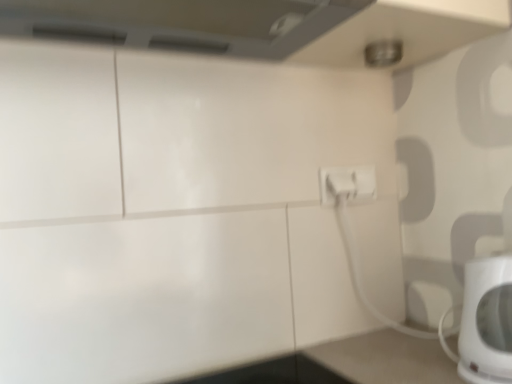
This screenshot has height=384, width=512. Describe the element at coordinates (347, 184) in the screenshot. I see `white plastic electric outlet at center-right` at that location.

What is the approximate width of white plastic electric outlet at center-right?

It is 1.53 inches.

Locate an element on the screen. white plastic electric outlet at center-right is located at coordinates (347, 184).

Measure the distance between point (475, 333) and camera.

The depth of point (475, 333) is 27.24 inches.

This screenshot has width=512, height=384. Find the location of `white glossy electric kettle at lower right`. white glossy electric kettle at lower right is located at coordinates tap(487, 321).

The image size is (512, 384). What do you see at coordinates (487, 321) in the screenshot?
I see `white glossy electric kettle at lower right` at bounding box center [487, 321].

The height and width of the screenshot is (384, 512). Find the location of `white plastic electric outlet at center-right`. white plastic electric outlet at center-right is located at coordinates (347, 184).

Considering the positions of objects white glossy electric kettle at lower right and white plastic electric outlet at center-right in the image provided, who is more to the right, white glossy electric kettle at lower right or white plastic electric outlet at center-right?

white glossy electric kettle at lower right is more to the right.

From the picture: Considering the positions of objects white glossy electric kettle at lower right and white plastic electric outlet at center-right in the image provided, who is behind, white glossy electric kettle at lower right or white plastic electric outlet at center-right?

white plastic electric outlet at center-right is more distant.

Which is closer, (465, 317) or (358, 170)?

Clearly, point (465, 317) is closer to the camera than point (358, 170).

From the image's perspective, which is above, white glossy electric kettle at lower right or white plastic electric outlet at center-right?

white plastic electric outlet at center-right, from the image's perspective.

Based on the photo, from a real-world perspective, is white glossy electric kettle at lower right physically below white plastic electric outlet at center-right?

Correct, in the physical world, white glossy electric kettle at lower right is lower than white plastic electric outlet at center-right.

In terms of width, does white glossy electric kettle at lower right look wider or thinner when compared to white plastic electric outlet at center-right?

In the image, white glossy electric kettle at lower right appears to be wider than white plastic electric outlet at center-right.

Does white glossy electric kettle at lower right have a lesser height compared to white plastic electric outlet at center-right?

In fact, white glossy electric kettle at lower right may be taller than white plastic electric outlet at center-right.

Considering the sizes of objects white glossy electric kettle at lower right and white plastic electric outlet at center-right in the image provided, who is smaller, white glossy electric kettle at lower right or white plastic electric outlet at center-right?

Smaller between the two is white plastic electric outlet at center-right.

Could white plastic electric outlet at center-right be considered to be inside white glossy electric kettle at lower right?

No.

Based on the photo, are white glossy electric kettle at lower right and white plastic electric outlet at center-right located far from each other?

They are positioned close to each other.

Is white glossy electric kettle at lower right oriented towards white plastic electric outlet at center-right?

No, white glossy electric kettle at lower right does not turn towards white plastic electric outlet at center-right.

Identify the location of electric outlet on the left of white glossy electric kettle at lower right. (347, 184).

Considering the relative positions of white plastic electric outlet at center-right and white glossy electric kettle at lower right in the image provided, is white plastic electric outlet at center-right to the left or to the right of white glossy electric kettle at lower right?

In the image, white plastic electric outlet at center-right appears on the left side of white glossy electric kettle at lower right.

Considering their positions, is white plastic electric outlet at center-right located in front of or behind white glossy electric kettle at lower right?

white plastic electric outlet at center-right is behind white glossy electric kettle at lower right.

Is point (375, 193) farther from viewer compared to point (465, 270)?

Yes.

From the image's perspective, between white plastic electric outlet at center-right and white glossy electric kettle at lower right, which one is located above?

white plastic electric outlet at center-right, from the image's perspective.

From a real-world perspective, is white plastic electric outlet at center-right positioned under white glossy electric kettle at lower right based on gravity?

No.

Which object is thinner, white plastic electric outlet at center-right or white glossy electric kettle at lower right?

With smaller width is white plastic electric outlet at center-right.

From their relative heights in the image, would you say white plastic electric outlet at center-right is taller or shorter than white glossy electric kettle at lower right?

Clearly, white plastic electric outlet at center-right is shorter compared to white glossy electric kettle at lower right.

Who is smaller, white plastic electric outlet at center-right or white glossy electric kettle at lower right?

With smaller size is white plastic electric outlet at center-right.

Do you think white plastic electric outlet at center-right is within white glossy electric kettle at lower right, or outside of it?

The correct answer is: outside.

In the scene shown: Is white plastic electric outlet at center-right placed right next to white glossy electric kettle at lower right?

No, white plastic electric outlet at center-right is not touching white glossy electric kettle at lower right.

Is white plastic electric outlet at center-right aimed at white glossy electric kettle at lower right?

No, white plastic electric outlet at center-right is not turned towards white glossy electric kettle at lower right.

Measure the distance between white plastic electric outlet at center-right and white glossy electric kettle at lower right.

They are 13.76 inches apart.

I want to click on home appliance lying in front of the white plastic electric outlet at center-right, so click(487, 321).

Where is `electric outlet lying behind the white glossy electric kettle at lower right`? The width and height of the screenshot is (512, 384). electric outlet lying behind the white glossy electric kettle at lower right is located at coordinates (347, 184).

At what (x,y) coordinates should I click in order to perform the action: click on home appliance that appears below the white plastic electric outlet at center-right (from a real-world perspective). Please return your answer as a coordinate pair (x, y). The width and height of the screenshot is (512, 384). Looking at the image, I should click on (487, 321).